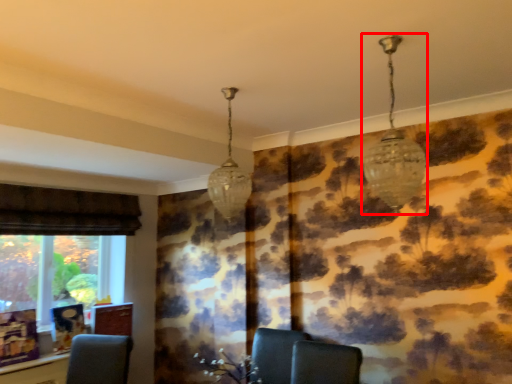
Question: From the image's perspective, what is the correct spatial relationship of lamp (annotated by the red box) in relation to lamp?

Choices:
 (A) below
 (B) above

Answer: (B)